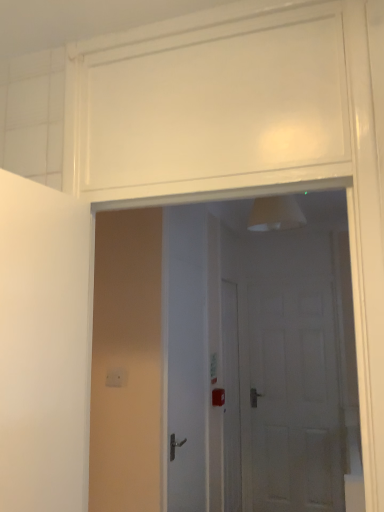
I want to click on white glossy door at center, the 3th door positioned from the right, so click(x=222, y=360).

Is point (199, 243) positioned before point (165, 318)?

That is False.

Considering the relative sizes of white glossy door at center, which ranks as the 2th door in right-to-left order, and white glossy door at center, the first door viewed from the front, in the image provided, is white glossy door at center, which ranks as the 2th door in right-to-left order, thinner than white glossy door at center, the first door viewed from the front,?

Yes.

Does white glossy door at center, marked as the 2th door in a front-to-back arrangement, come behind white glossy door at center, the 3th door when ordered from back to front?

Yes, white glossy door at center, marked as the 2th door in a front-to-back arrangement, is further from the viewer.

Is white glossy door at center, marked as the 2th door in a front-to-back arrangement, facing away from white glossy door at center, the first door viewed from the front?

white glossy door at center, marked as the 2th door in a front-to-back arrangement, is not turned away from white glossy door at center, the first door viewed from the front.

From the picture: Which is in front, white glossy door at center, the 3th door positioned from the right, or white glossy door at center, which is the 2th door from left to right?

white glossy door at center, the 3th door positioned from the right, is more forward.

Is white glossy door at center, the first door viewed from the front, smaller than white glossy door at center, marked as the 2th door in a front-to-back arrangement?

Actually, white glossy door at center, the first door viewed from the front, might be larger than white glossy door at center, marked as the 2th door in a front-to-back arrangement.

Would you say white glossy door at center, the 3th door when ordered from back to front, contains white glossy door at center, which ranks as the 2th door in right-to-left order?

No, white glossy door at center, which ranks as the 2th door in right-to-left order, is not inside white glossy door at center, the 3th door when ordered from back to front.

Is point (278, 362) positioned in front of point (181, 426)?

That is False.

From the image's perspective, relative to white glossy door at center, marked as the 2th door in a front-to-back arrangement, is white matte door at center, which ranks as the first door in back-to-front order, above or below?

Clearly, from the image's perspective, white matte door at center, which ranks as the first door in back-to-front order, is below white glossy door at center, marked as the 2th door in a front-to-back arrangement.

Considering the sizes of objects white matte door at center, which is counted as the 3th door, starting from the front, and white glossy door at center, which ranks as the 2th door in right-to-left order, in the image provided, who is wider, white matte door at center, which is counted as the 3th door, starting from the front, or white glossy door at center, which ranks as the 2th door in right-to-left order,?

white matte door at center, which is counted as the 3th door, starting from the front.

Is white matte door at center, which ranks as the first door in back-to-front order, not within white glossy door at center, which is the 2th door from left to right?

Yes.

Are white matte door at center, which is counted as the 3th door, starting from the front, and white glossy door at center, which ranks as the 2th door in right-to-left order, beside each other?

They are not placed beside each other.

What's the angular difference between white matte door at center, which ranks as the first door in back-to-front order, and white glossy door at center, the 3th door when ordered from back to front,'s facing directions?

0.00119 degrees.

Which is more to the right, white matte door at center, which is counted as the 3th door, starting from the front, or white glossy door at center, the first door viewed from the front?

Positioned to the right is white matte door at center, which is counted as the 3th door, starting from the front.

Is white matte door at center, placed as the third door when sorted from left to right, not close to white glossy door at center, the 3th door when ordered from back to front?

They are positioned close to each other.

Considering the sizes of objects white matte door at center, placed as the third door when sorted from left to right, and white glossy door at center, the 3th door positioned from the right, in the image provided, who is bigger, white matte door at center, placed as the third door when sorted from left to right, or white glossy door at center, the 3th door positioned from the right,?

With larger size is white matte door at center, placed as the third door when sorted from left to right.

Which of these two, white glossy door at center, which is the second door in back-to-front order, or white matte door at center, which ranks as the first door in back-to-front order, is bigger?

With larger size is white matte door at center, which ranks as the first door in back-to-front order.

From the image's perspective, is white glossy door at center, which is the 2th door from left to right, located above or below white matte door at center, which ranks as the first door in back-to-front order?

Clearly, from the image's perspective, white glossy door at center, which is the 2th door from left to right, is above white matte door at center, which ranks as the first door in back-to-front order.

Between white glossy door at center, which is the second door in back-to-front order, and white matte door at center, which ranks as the first door in back-to-front order, which one has less height?

white glossy door at center, which is the second door in back-to-front order, is shorter.

Considering the positions of objects white glossy door at center, marked as the 2th door in a front-to-back arrangement, and white matte door at center, which is counted as the 1th door, starting from the right, in the image provided, who is more to the left, white glossy door at center, marked as the 2th door in a front-to-back arrangement, or white matte door at center, which is counted as the 1th door, starting from the right,?

white glossy door at center, marked as the 2th door in a front-to-back arrangement, is more to the left.

Who is smaller, white glossy door at center, the 3th door when ordered from back to front, or white matte door at center, which ranks as the first door in back-to-front order?

Smaller between the two is white glossy door at center, the 3th door when ordered from back to front.

Is white glossy door at center, the 3th door when ordered from back to front, facing away from white matte door at center, which ranks as the first door in back-to-front order?

Yes, white glossy door at center, the 3th door when ordered from back to front, is facing away from white matte door at center, which ranks as the first door in back-to-front order.

From the image's perspective, is white glossy door at center, which appears as the 1th door when viewed from the left, above white matte door at center, which is counted as the 1th door, starting from the right?

Yes, from the image's perspective, white glossy door at center, which appears as the 1th door when viewed from the left, is above white matte door at center, which is counted as the 1th door, starting from the right.

The height and width of the screenshot is (512, 384). I want to click on door lying on the left of white glossy door at center, which is the 2th door from left to right, so click(222, 360).

Find the location of a particular element. door in front of the white glossy door at center, which is the 2th door from left to right is located at coordinates (222, 360).

Estimate the real-world distances between objects in this image. Which object is closer to white glossy door at center, the 3th door positioned from the right, white glossy door at center, which ranks as the 2th door in right-to-left order, or white matte door at center, placed as the third door when sorted from left to right?

white matte door at center, placed as the third door when sorted from left to right, lies closer to white glossy door at center, the 3th door positioned from the right, than the other object.

When comparing their distances from white glossy door at center, which ranks as the 2th door in right-to-left order, does white glossy door at center, the 3th door positioned from the right, or white matte door at center, which is counted as the 3th door, starting from the front, seem further?

Based on the image, white matte door at center, which is counted as the 3th door, starting from the front, appears to be further to white glossy door at center, which ranks as the 2th door in right-to-left order.

Looking at the image, which one is located closer to white matte door at center, which is counted as the 1th door, starting from the right, white glossy door at center, the 3th door when ordered from back to front, or white glossy door at center, which is the 2th door from left to right?

Among the two, white glossy door at center, the 3th door when ordered from back to front, is located nearer to white matte door at center, which is counted as the 1th door, starting from the right.

Looking at the image, which one is located further to white glossy door at center, which is the 2th door from left to right, white matte door at center, which is counted as the 1th door, starting from the right, or white glossy door at center, the 3th door when ordered from back to front?

white matte door at center, which is counted as the 1th door, starting from the right, is positioned further to the anchor white glossy door at center, which is the 2th door from left to right.

Which object lies nearer to the anchor point white glossy door at center, the first door viewed from the front, white matte door at center, which is counted as the 1th door, starting from the right, or white glossy door at center, which ranks as the 2th door in right-to-left order?

white matte door at center, which is counted as the 1th door, starting from the right, is closer to white glossy door at center, the first door viewed from the front.

Considering their positions, is white glossy door at center, which is the second door in back-to-front order, positioned closer to white matte door at center, which ranks as the first door in back-to-front order, than white glossy door at center, the first door viewed from the front?

Based on the image, white glossy door at center, the first door viewed from the front, appears to be nearer to white matte door at center, which ranks as the first door in back-to-front order.

The image size is (384, 512). Find the location of `door between white glossy door at center, which appears as the 1th door when viewed from the left, and white matte door at center, which is counted as the 3th door, starting from the front, along the z-axis`. door between white glossy door at center, which appears as the 1th door when viewed from the left, and white matte door at center, which is counted as the 3th door, starting from the front, along the z-axis is located at coordinates (186, 354).